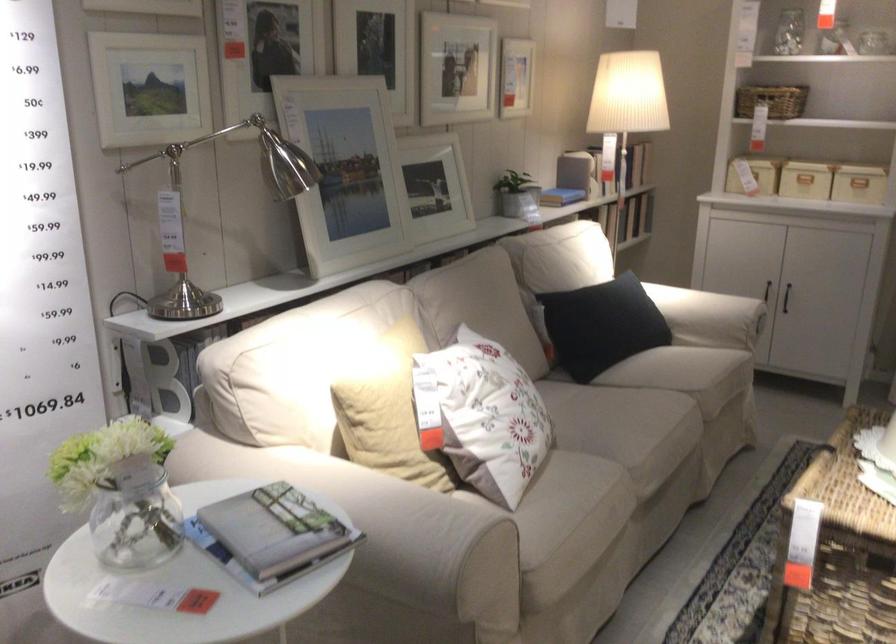
Image resolution: width=896 pixels, height=644 pixels. I want to click on beige sofa sitting surface, so click(x=596, y=442).